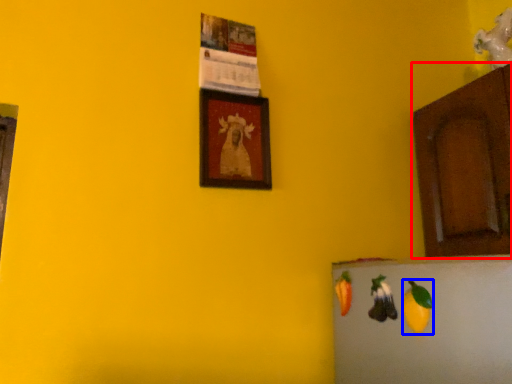
Question: Which object appears farthest to the camera in this image, cabinetry (highlighted by a red box) or fruit (highlighted by a blue box)?

Choices:
 (A) cabinetry
 (B) fruit

Answer: (A)